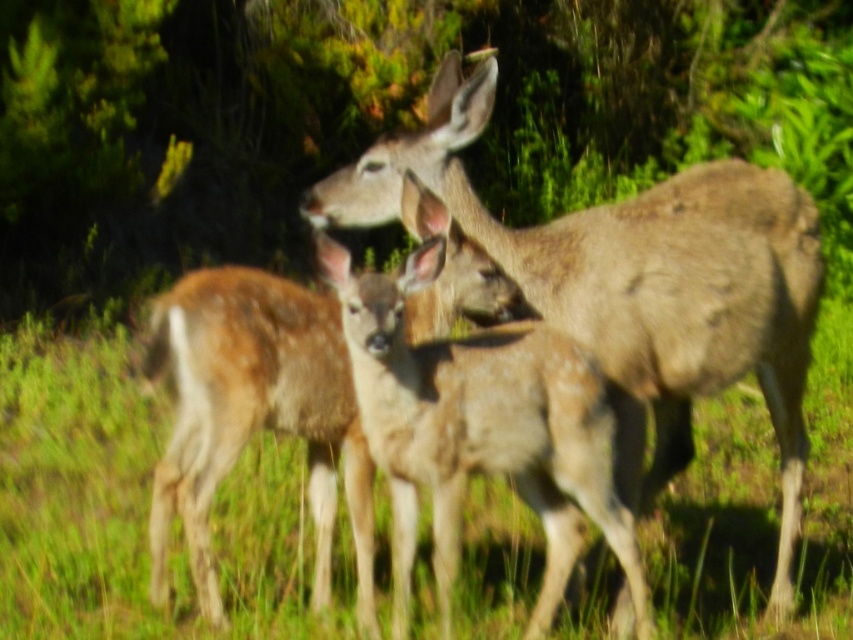
Question: Observing the image, what is the correct spatial positioning of brown fur deer at center in reference to spotted fur deer at center?

Choices:
 (A) right
 (B) left

Answer: (A)

Question: Is brown fur deer at center above spotted fur deer at center?

Choices:
 (A) yes
 (B) no

Answer: (A)

Question: Which point appears farthest from the camera in this image?

Choices:
 (A) (751, 218)
 (B) (527, 637)

Answer: (A)

Question: Is brown fur deer at center wider than spotted fur deer at center?

Choices:
 (A) yes
 (B) no

Answer: (A)